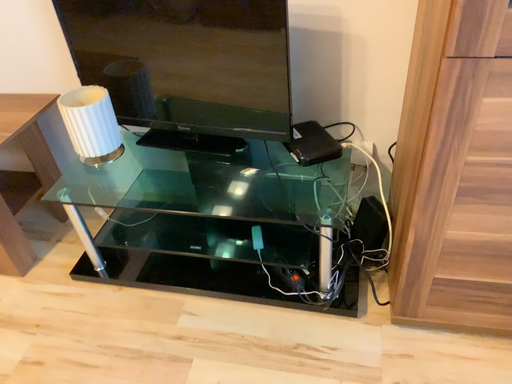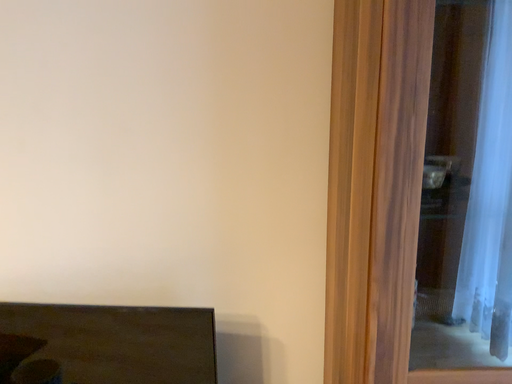
Question: Which way did the camera rotate in the video?

Choices:
 (A) rotated downward
 (B) rotated upward

Answer: (B)